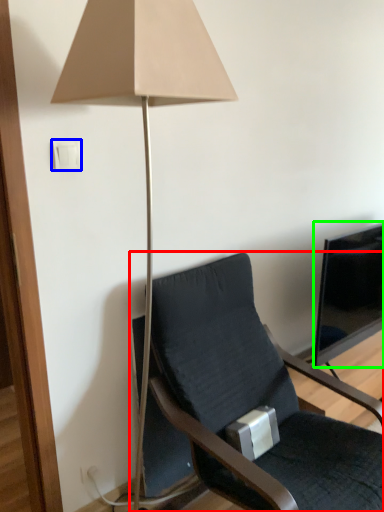
Question: Which object is the farthest from chair (highlighted by a red box)? Choose among these: light switch (highlighted by a blue box) or television (highlighted by a green box).

Choices:
 (A) light switch
 (B) television

Answer: (A)